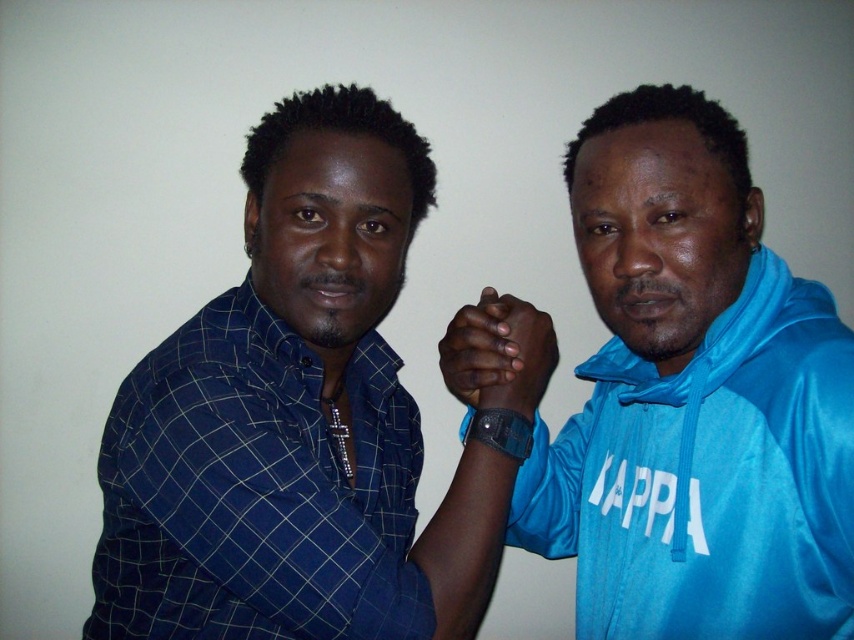
Who is positioned more to the right, blue satin hoodie at center or dark skin hand at center?

From the viewer's perspective, blue satin hoodie at center appears more on the right side.

Who is more forward, (559, 541) or (455, 355)?

Point (455, 355)

Locate an element on the screen. This screenshot has height=640, width=854. blue satin hoodie at center is located at coordinates (694, 400).

Locate an element on the screen. This screenshot has width=854, height=640. blue checkered shirt at left is located at coordinates (305, 419).

Is blue checkered shirt at left in front of blue satin hoodie at center?

No, blue checkered shirt at left is further to the viewer.

The height and width of the screenshot is (640, 854). I want to click on blue checkered shirt at left, so click(x=305, y=419).

Can you confirm if blue checkered shirt at left is shorter than dark skin hand at center?

No, blue checkered shirt at left is not shorter than dark skin hand at center.

Which is above, blue checkered shirt at left or dark skin hand at center?

Positioned higher is dark skin hand at center.

Where is `blue checkered shirt at left`? blue checkered shirt at left is located at coordinates (305, 419).

The width and height of the screenshot is (854, 640). In order to click on blue checkered shirt at left in this screenshot , I will do `click(305, 419)`.